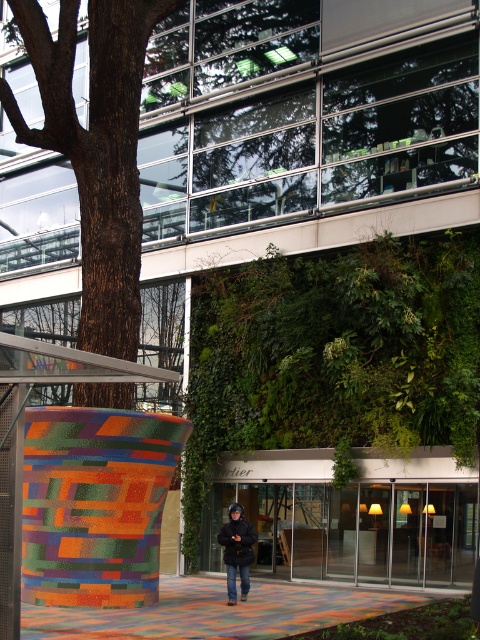
You are a photographer standing in front of the brown rough bark tree at left and the black matte jacket at center. You want to capture both objects in a single frame. Which object should you focus on first to ensure both are in the frame?

The brown rough bark tree at left is taller than the black matte jacket at center, so you should focus on the brown rough bark tree at left first to ensure both are in the frame.

Based on the photo, you are an architect designing a new outdoor space. You need to place a bench next to the brown rough bark tree at left and the black matte jacket at center. Which object should the bench be placed closer to if you want it to be proportionally sized to the objects?

The bench should be placed closer to the brown rough bark tree at left because it is bigger than the black matte jacket at center, so the bench needs to be proportionally larger near the larger object.